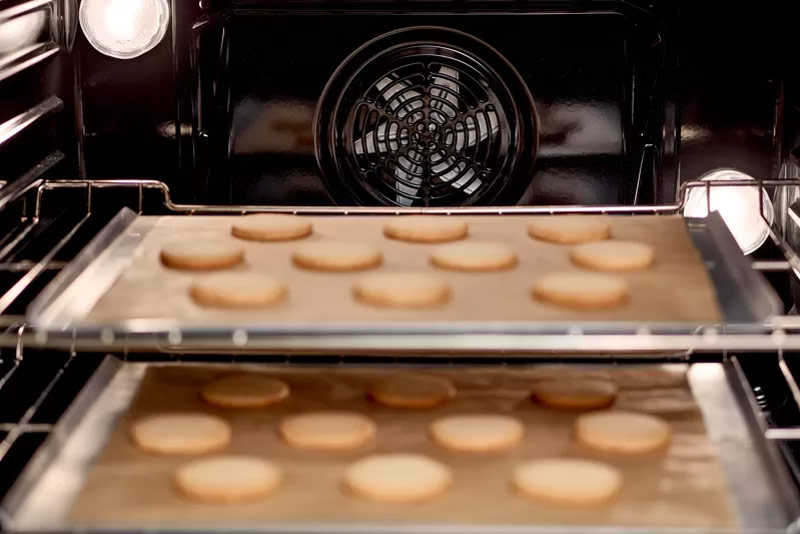
The image size is (800, 534). I want to click on cookies on top rack, so click(x=584, y=288), click(x=406, y=294), click(x=474, y=254), click(x=430, y=230), click(x=561, y=229), click(x=617, y=254), click(x=334, y=257), click(x=270, y=224), click(x=206, y=254), click(x=230, y=288).